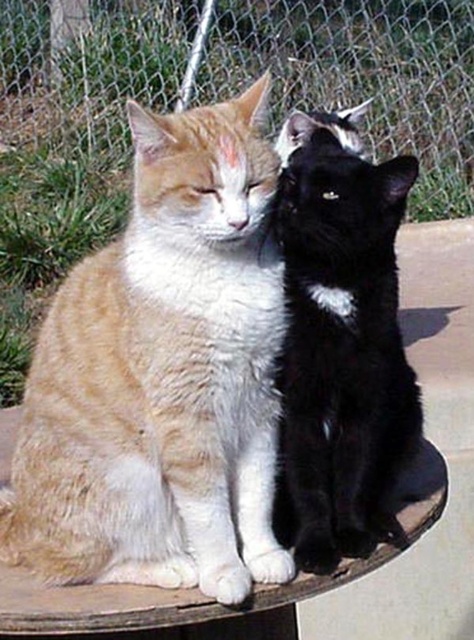
How much distance is there between tabby fur cat at center and wooden table at center?

tabby fur cat at center and wooden table at center are 8.52 inches apart.

Is tabby fur cat at center above wooden table at center?

Yes, tabby fur cat at center is above wooden table at center.

Who is more forward, (53,381) or (400,520)?

Point (53,381)

At what (x,y) coordinates should I click in order to perform the action: click on tabby fur cat at center. Please return your answer as a coordinate pair (x, y). Looking at the image, I should click on (163, 376).

Between metal mesh fence at upper center and black glossy cat at center, which one has more height?

Standing taller between the two is metal mesh fence at upper center.

Which of these two, metal mesh fence at upper center or black glossy cat at center, stands shorter?

With less height is black glossy cat at center.

Is point (403, 81) farther from viewer compared to point (325, 269)?

Yes, point (403, 81) is farther from viewer.

Where is `metal mesh fence at upper center`? This screenshot has width=474, height=640. metal mesh fence at upper center is located at coordinates (362, 76).

From the picture: Which of these two, metal mesh fence at upper center or wooden table at center, stands shorter?

wooden table at center is shorter.

Which is more to the left, metal mesh fence at upper center or wooden table at center?

Positioned to the left is metal mesh fence at upper center.

Who is more forward, (281, 67) or (54, 600)?

Positioned in front is point (54, 600).

Locate an element on the screen. metal mesh fence at upper center is located at coordinates (362, 76).